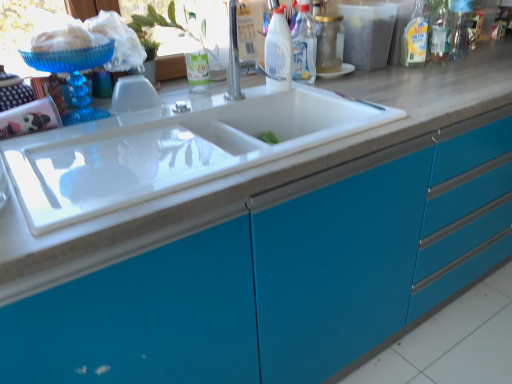
You are a GUI agent. You are given a task and a screenshot of the screen. Output one action in this format:
    pyautogui.click(x=<x>, y=<y>)
    Task: Click on the vacant area that is in front of transparent glass jar at upper center, the third bottle positioned from the left
    The image size is (512, 384).
    Given the screenshot: What is the action you would take?
    point(340,84)